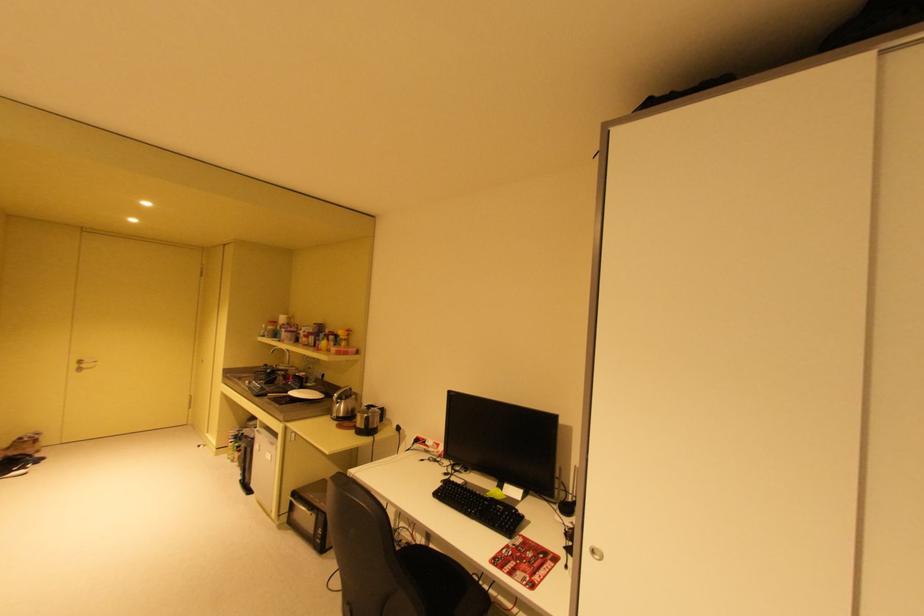
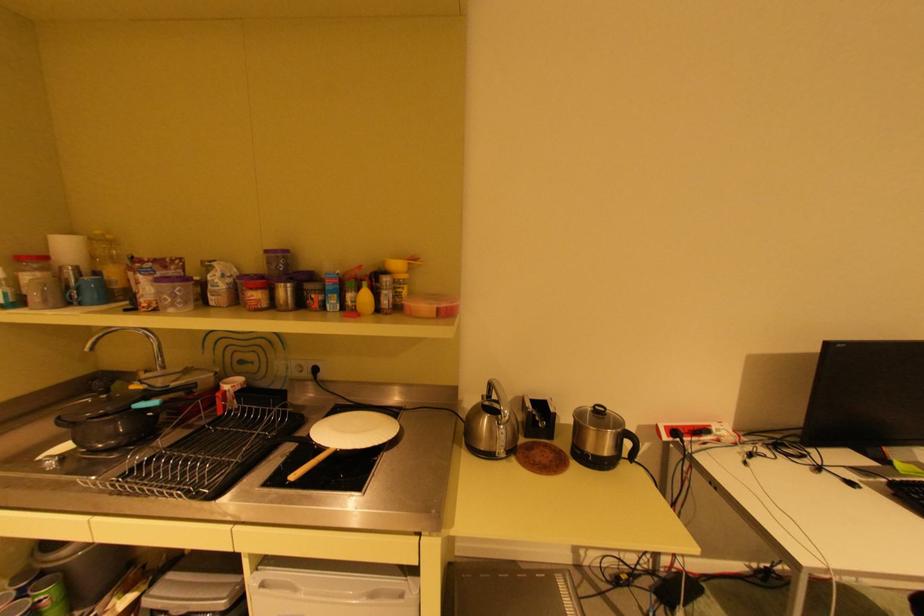
Where in the second image is the point corresponding to point 322,323 from the first image?

(274, 251)